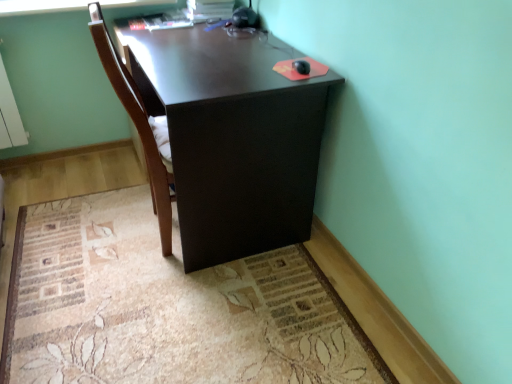
Question: Is dark wood desk at center with brown wood chair at center?

Choices:
 (A) no
 (B) yes

Answer: (A)

Question: Is dark wood desk at center completely or partially outside of brown wood chair at center?

Choices:
 (A) yes
 (B) no

Answer: (A)

Question: From the image's perspective, is dark wood desk at center located above brown wood chair at center?

Choices:
 (A) yes
 (B) no

Answer: (A)

Question: Could you tell me if dark wood desk at center is turned towards brown wood chair at center?

Choices:
 (A) no
 (B) yes

Answer: (B)

Question: From the image's perspective, is dark wood desk at center under brown wood chair at center?

Choices:
 (A) yes
 (B) no

Answer: (B)

Question: Considering the relative sizes of dark wood desk at center and brown wood chair at center in the image provided, is dark wood desk at center wider than brown wood chair at center?

Choices:
 (A) yes
 (B) no

Answer: (A)

Question: From the image's perspective, is brown wood chair at center on top of dark wood desk at center?

Choices:
 (A) yes
 (B) no

Answer: (B)

Question: Considering the relative positions of brown wood chair at center and dark wood desk at center in the image provided, is brown wood chair at center to the right of dark wood desk at center from the viewer's perspective?

Choices:
 (A) yes
 (B) no

Answer: (B)

Question: Can you confirm if brown wood chair at center is thinner than dark wood desk at center?

Choices:
 (A) yes
 (B) no

Answer: (A)

Question: Can you confirm if brown wood chair at center is shorter than dark wood desk at center?

Choices:
 (A) yes
 (B) no

Answer: (B)

Question: From a real-world perspective, is brown wood chair at center located beneath dark wood desk at center?

Choices:
 (A) no
 (B) yes

Answer: (A)

Question: From a real-world perspective, does brown wood chair at center stand above dark wood desk at center?

Choices:
 (A) yes
 (B) no

Answer: (A)

Question: Does dark wood desk at center have a smaller size compared to beige carpet at lower center?

Choices:
 (A) yes
 (B) no

Answer: (B)